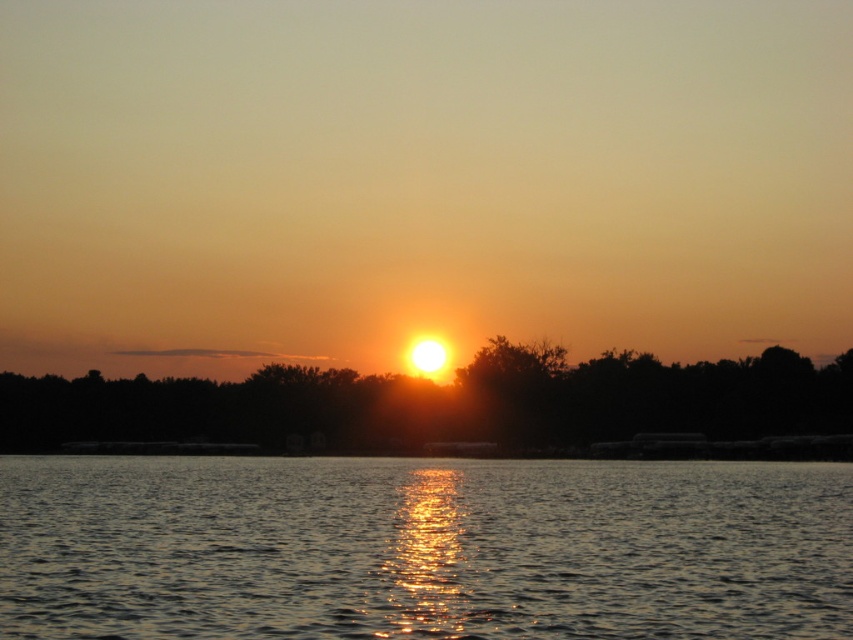
You are standing on the shore observing the sunset. You notice two areas of water in front of you. One is labeled as glistening water at center and the other as golden reflective water at center. Which area appears closer to you based on their heights?

The glistening water at center appears closer because it has a lesser height compared to the golden reflective water at center, which is positioned further away.

You are standing on a dock and see the glistening water at center and the golden reflective water at center. Which one is closer to you?

The glistening water at center is closer to you because it is in front of the golden reflective water at center.

You are standing on the shore observing the sunset. You notice two areas of water in front of you. One is labeled as glistening water at center and the other as golden reflective water at center. Which of these two areas is positioned lower in the scene?

The glistening water at center is positioned below the golden reflective water at center, so it is lower in the scene.